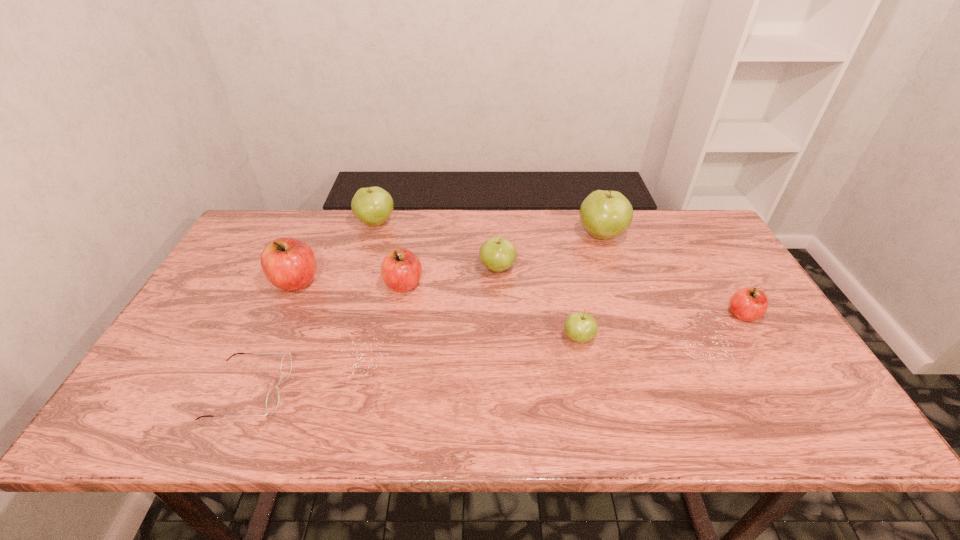
Find the location of a particular element. vacant space that is in between the spectacles and the sixth object from left to right is located at coordinates (414, 364).

Locate an element on the screen. This screenshot has width=960, height=540. free space between the second biggest red apple and the spectacles is located at coordinates (326, 338).

This screenshot has width=960, height=540. I want to click on object that stands as the fifth closest to the third smallest green apple, so click(x=606, y=214).

Locate which object ranks in proximity to the second biggest red apple. Please provide its 2D coordinates. Your answer should be formatted as a tuple, i.e. [(x, y)], where the tuple contains the x and y coordinates of a point satisfying the conditions above.

[(497, 254)]

Find the location of a particular element. The height and width of the screenshot is (540, 960). apple that is the sixth closest to the biggest red apple is located at coordinates (748, 304).

Locate which apple ranks fourth in proximity to the nearest green apple. Please provide its 2D coordinates. Your answer should be formatted as a tuple, i.e. [(x, y)], where the tuple contains the x and y coordinates of a point satisfying the conditions above.

[(401, 270)]

In order to click on green apple that is the third closest to the nearest green apple in this screenshot , I will do `click(373, 206)`.

Identify the location of green apple that is the closest to the second biggest green apple. (497, 254).

Select which red apple appears as the closest to the sixth apple from right to left. Please provide its 2D coordinates. Your answer should be formatted as a tuple, i.e. [(x, y)], where the tuple contains the x and y coordinates of a point satisfying the conditions above.

[(289, 264)]

Identify which red apple is the second closest to the spectacles. Please provide its 2D coordinates. Your answer should be formatted as a tuple, i.e. [(x, y)], where the tuple contains the x and y coordinates of a point satisfying the conditions above.

[(401, 270)]